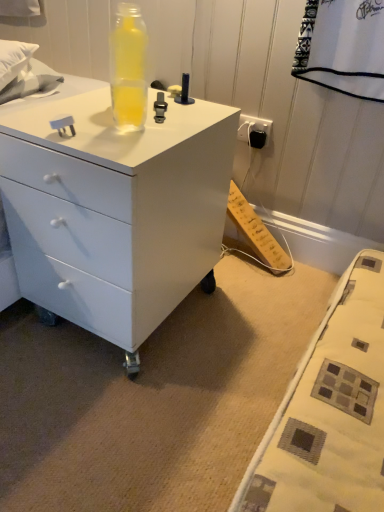
Question: Is transparent plastic bottle at upper center taller than white glossy chest of drawers at center?

Choices:
 (A) yes
 (B) no

Answer: (B)

Question: From a real-world perspective, is transparent plastic bottle at upper center under white glossy chest of drawers at center?

Choices:
 (A) yes
 (B) no

Answer: (B)

Question: Would you say transparent plastic bottle at upper center is outside white glossy chest of drawers at center?

Choices:
 (A) no
 (B) yes

Answer: (B)

Question: Could you tell me if transparent plastic bottle at upper center is facing white glossy chest of drawers at center?

Choices:
 (A) yes
 (B) no

Answer: (B)

Question: Is transparent plastic bottle at upper center smaller than white glossy chest of drawers at center?

Choices:
 (A) yes
 (B) no

Answer: (A)

Question: Can you confirm if transparent plastic bottle at upper center is bigger than white glossy chest of drawers at center?

Choices:
 (A) yes
 (B) no

Answer: (B)

Question: Does white glossy chest of drawers at center lie behind transparent plastic bottle at upper center?

Choices:
 (A) no
 (B) yes

Answer: (A)

Question: Is white glossy chest of drawers at center located outside transparent plastic bottle at upper center?

Choices:
 (A) no
 (B) yes

Answer: (B)

Question: From the image's perspective, does white glossy chest of drawers at center appear lower than transparent plastic bottle at upper center?

Choices:
 (A) no
 (B) yes

Answer: (B)

Question: From a real-world perspective, does white glossy chest of drawers at center sit lower than transparent plastic bottle at upper center?

Choices:
 (A) no
 (B) yes

Answer: (B)

Question: Does white glossy chest of drawers at center appear on the right side of transparent plastic bottle at upper center?

Choices:
 (A) yes
 (B) no

Answer: (B)

Question: Is white glossy chest of drawers at center positioned before transparent plastic bottle at upper center?

Choices:
 (A) no
 (B) yes

Answer: (B)

Question: Is white glossy chest of drawers at center in front of or behind transparent plastic bottle at upper center in the image?

Choices:
 (A) front
 (B) behind

Answer: (A)